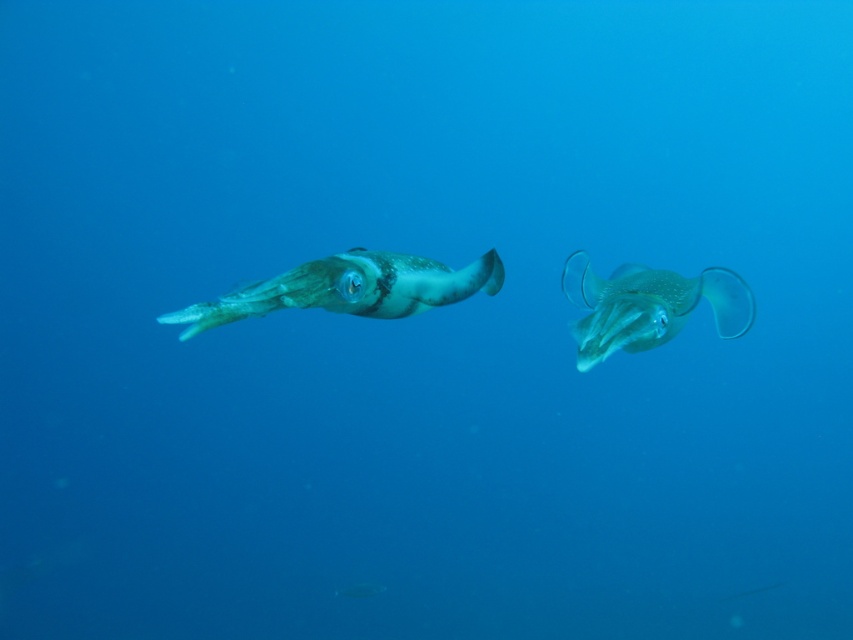
You are a marine biologist observing two squid underwater. You notice a translucent green squid at left and another squid. Based on their positions, which squid is closer to the bottom of the ocean?

The translucent green squid at left is closer to the bottom of the ocean because it is located at point 0.410 on the y axis, which is lower than the other squid.

You are a marine biologist observing two squid underwater. You notice the translucent green squid at left and the translucent rubber squid at center. Which one is positioned more to the left side of the image?

The translucent green squid at left is positioned more to the left side of the image than the translucent rubber squid at center.

You are a marine biologist observing underwater. You see the translucent green squid at left and the translucent rubber squid at center. Which one is nearer to you?

The translucent green squid at left is closer to the viewer than the translucent rubber squid at center.